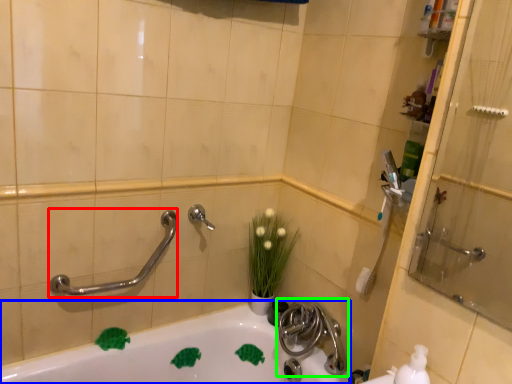
Question: Which object is the farthest from shower (highlighted by a red box)? Choose among these: bathtub (highlighted by a blue box) or tap (highlighted by a green box).

Choices:
 (A) bathtub
 (B) tap

Answer: (B)